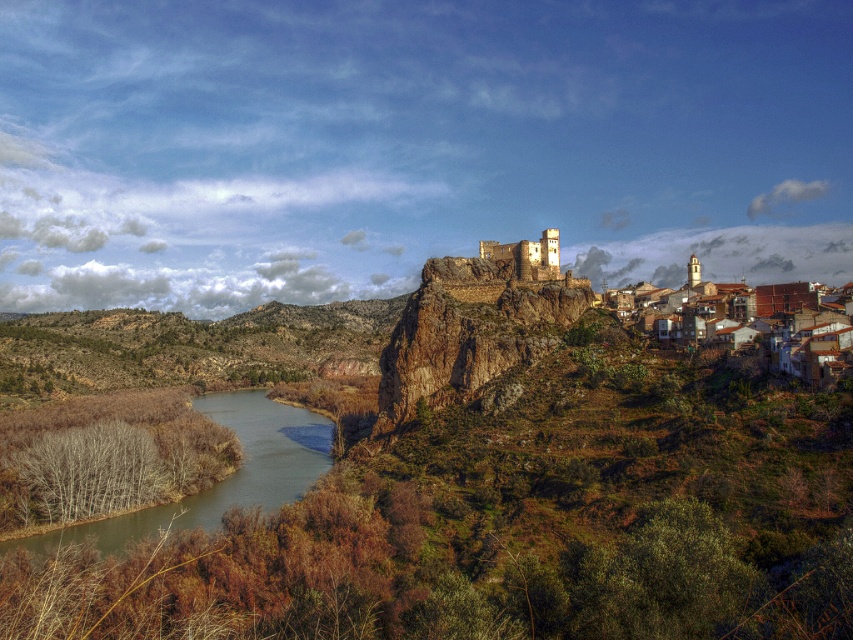
Is brown/rough water at lower left positioned in front of brown clay houses at lower right?

No, brown/rough water at lower left is further to the viewer.

Is brown/rough water at lower left smaller than brown clay houses at lower right?

Actually, brown/rough water at lower left might be larger than brown clay houses at lower right.

Does point (287, 408) lie in front of point (717, 333)?

No, (287, 408) is further to viewer.

At what (x,y) coordinates should I click in order to perform the action: click on brown/rough water at lower left. Please return your answer as a coordinate pair (x, y). This screenshot has width=853, height=640. Looking at the image, I should click on (225, 476).

Does brown clay houses at lower right appear on the left side of light brown stone castle at center?

No, brown clay houses at lower right is not to the left of light brown stone castle at center.

Does brown clay houses at lower right have a lesser width compared to light brown stone castle at center?

Incorrect, brown clay houses at lower right's width is not less than light brown stone castle at center's.

Describe the element at coordinates (764, 324) in the screenshot. The width and height of the screenshot is (853, 640). I see `brown clay houses at lower right` at that location.

Where is `brown clay houses at lower right`? brown clay houses at lower right is located at coordinates (764, 324).

Does brown/rough water at lower left have a lesser height compared to light brown stone castle at center?

Indeed, brown/rough water at lower left has a lesser height compared to light brown stone castle at center.

In order to click on brown/rough water at lower left in this screenshot , I will do `click(225, 476)`.

I want to click on brown/rough water at lower left, so click(x=225, y=476).

I want to click on brown/rough water at lower left, so click(225, 476).